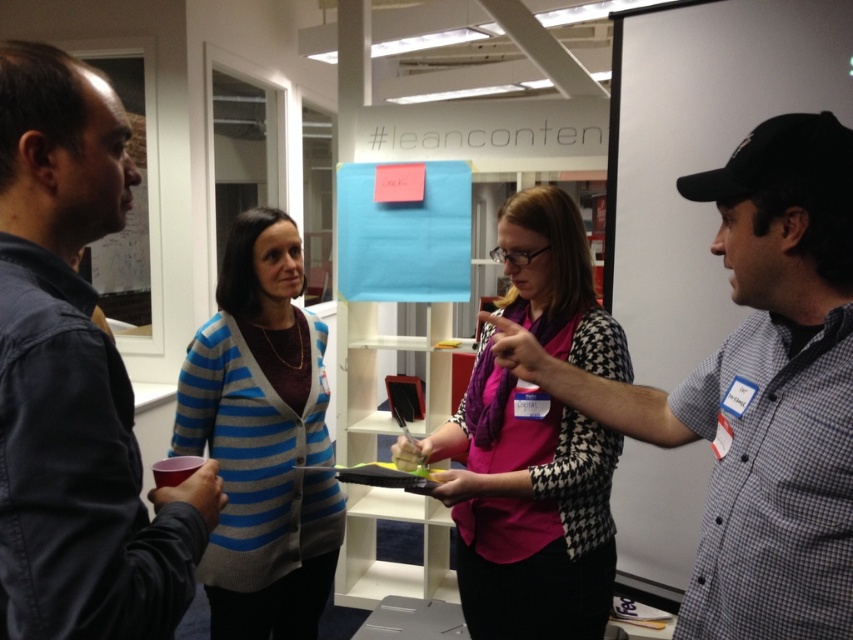
Question: Which object is positioned farthest from the dark blue denim jacket at left?

Choices:
 (A) pink fabric scarf at center
 (B) blue striped cardigan at center

Answer: (B)

Question: Is pink fabric scarf at center behind blue striped cardigan at center?

Choices:
 (A) no
 (B) yes

Answer: (A)

Question: Among these points, which one is nearest to the camera?

Choices:
 (A) (764, 586)
 (B) (310, 372)
 (C) (578, 627)

Answer: (A)

Question: From the image, what is the correct spatial relationship of pink fabric scarf at center in relation to blue striped cardigan at center?

Choices:
 (A) above
 (B) below

Answer: (A)

Question: Does pink fabric scarf at center appear over blue striped cardigan at center?

Choices:
 (A) yes
 (B) no

Answer: (A)

Question: Which of the following is the closest to the observer?

Choices:
 (A) (78, 193)
 (B) (407, 442)
 (C) (846, 445)

Answer: (C)